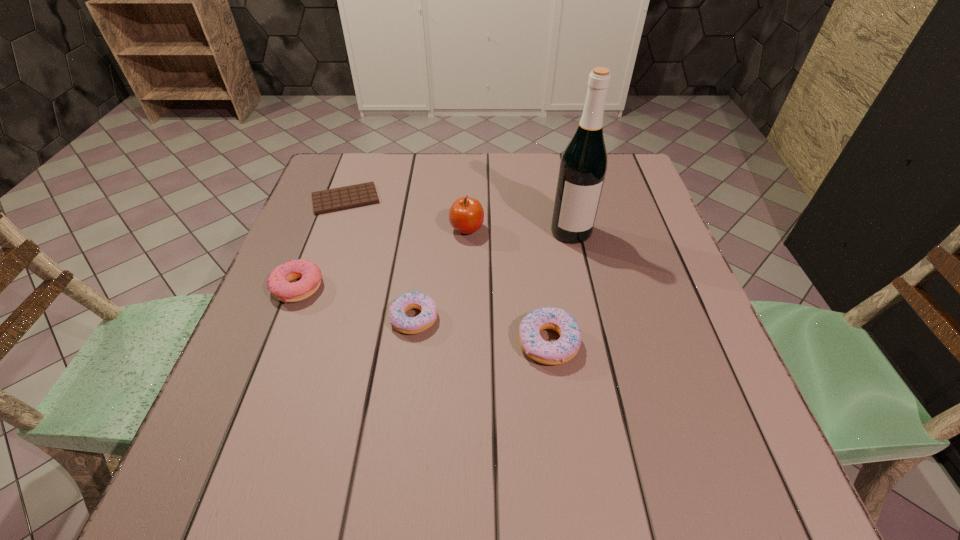
Locate an element on the screen. The height and width of the screenshot is (540, 960). vacant region at the near edge of the desktop is located at coordinates (x=429, y=388).

Locate an element on the screen. vacant space at the right edge is located at coordinates (659, 272).

This screenshot has width=960, height=540. Find the location of `blank area at the far left corner`. blank area at the far left corner is located at coordinates (334, 168).

Locate an element on the screen. This screenshot has width=960, height=540. free region at the near left corner of the desktop is located at coordinates (225, 392).

This screenshot has height=540, width=960. I want to click on free location at the far right corner, so click(x=621, y=184).

I want to click on vacant area that lies between the chocolate bar and the fourth object from right to left, so click(380, 259).

Identify the location of free spot between the apple and the chocolate bar. The height and width of the screenshot is (540, 960). (406, 214).

Image resolution: width=960 pixels, height=540 pixels. Identify the location of free space between the leftmost doughnut and the tallest object. (435, 259).

The height and width of the screenshot is (540, 960). Find the location of `vacant area that lies between the fourth object from right to left and the third tallest object`. vacant area that lies between the fourth object from right to left and the third tallest object is located at coordinates (482, 330).

Find the location of a particular element. unoccupied area between the leftmost doughnut and the second tallest object is located at coordinates (382, 258).